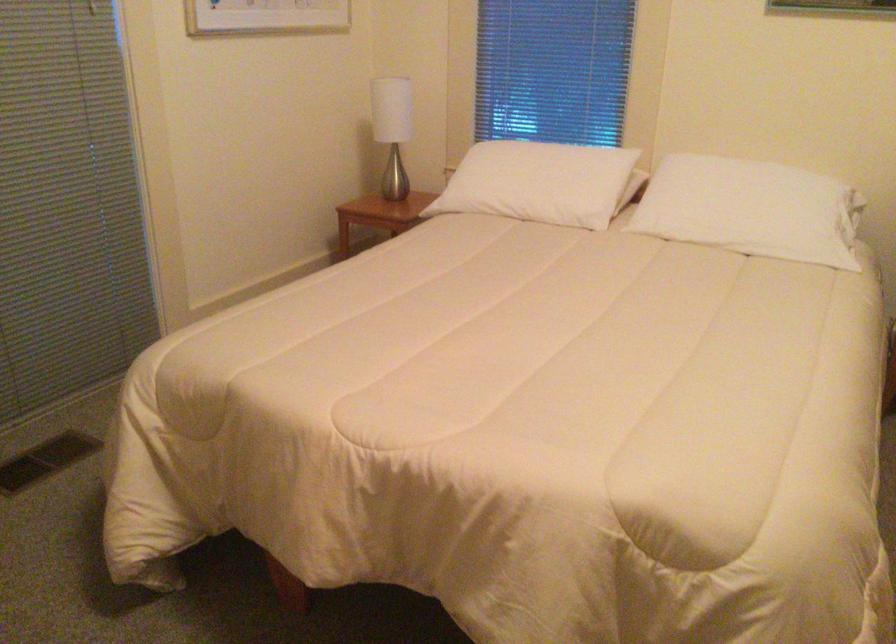
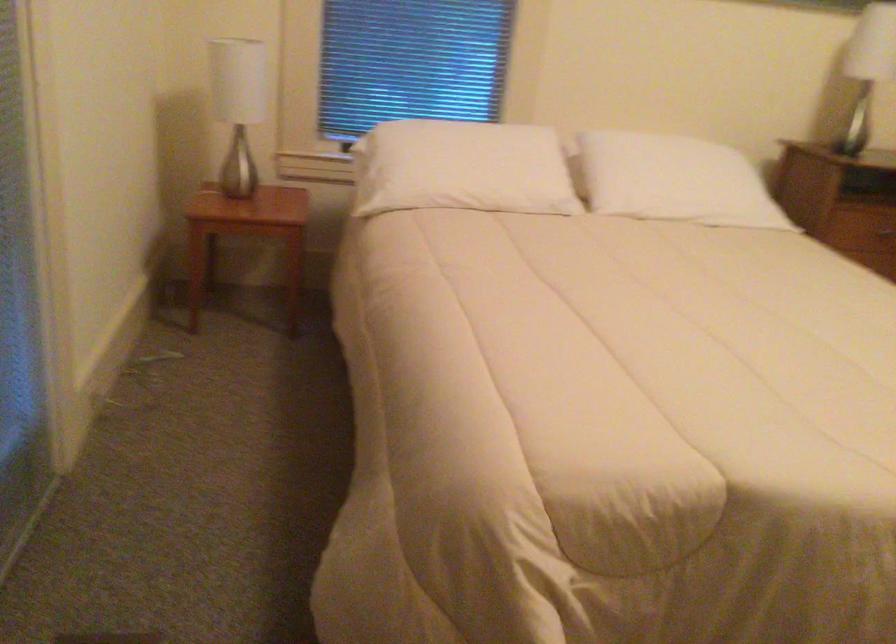
Find the pixel in the second image that matches [716,207] in the first image.

(673, 180)